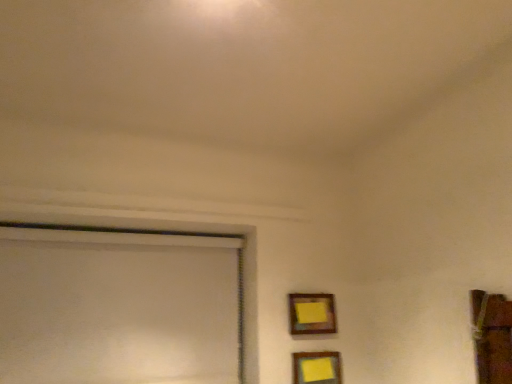
Question: From the image's perspective, relative to wooden frame at lower right, the 1th picture frame viewed from the top, is wooden framed picture at lower center, marked as the second picture frame in a top-to-bottom arrangement, above or below?

Choices:
 (A) below
 (B) above

Answer: (A)

Question: Which is correct: wooden framed picture at lower center, the 1th picture frame positioned from the bottom, is inside wooden frame at lower right, positioned as the 2th picture frame in bottom-to-top order, or outside of it?

Choices:
 (A) outside
 (B) inside

Answer: (A)

Question: From a real-world perspective, is wooden framed picture at lower center, the 1th picture frame positioned from the bottom, positioned above or below wooden frame at lower right, the 1th picture frame viewed from the top?

Choices:
 (A) below
 (B) above

Answer: (A)

Question: From the image's perspective, is wooden frame at lower right, the 1th picture frame viewed from the top, positioned above or below wooden framed picture at lower center, marked as the second picture frame in a top-to-bottom arrangement?

Choices:
 (A) below
 (B) above

Answer: (B)

Question: Visually, is wooden frame at lower right, the 1th picture frame viewed from the top, positioned to the left or to the right of wooden framed picture at lower center, marked as the second picture frame in a top-to-bottom arrangement?

Choices:
 (A) left
 (B) right

Answer: (A)

Question: Does point (325, 314) appear closer or farther from the camera than point (292, 367)?

Choices:
 (A) closer
 (B) farther

Answer: (B)

Question: Would you say wooden frame at lower right, positioned as the 2th picture frame in bottom-to-top order, is inside or outside wooden framed picture at lower center, the 1th picture frame positioned from the bottom?

Choices:
 (A) inside
 (B) outside

Answer: (B)